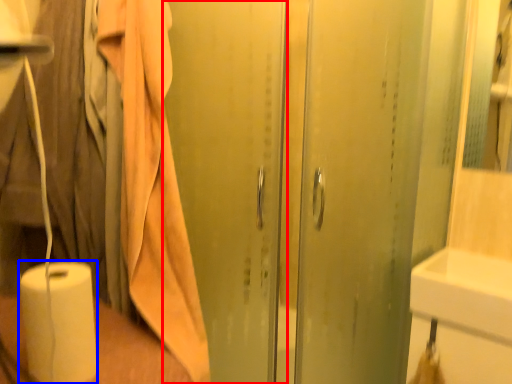
Question: Among these objects, which one is farthest to the camera, screen door (highlighted by a red box) or paper towel (highlighted by a blue box)?

Choices:
 (A) screen door
 (B) paper towel

Answer: (A)